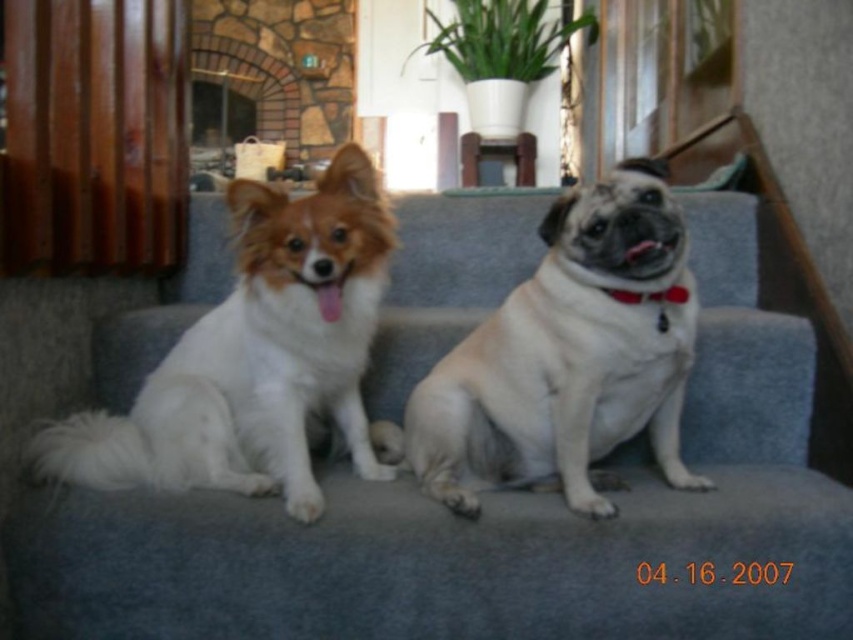
Is gray fabric couch at center further to the viewer compared to white fabric neckband at center?

That is False.

What do you see at coordinates (492, 525) in the screenshot?
I see `gray fabric couch at center` at bounding box center [492, 525].

Where is `gray fabric couch at center`? This screenshot has width=853, height=640. gray fabric couch at center is located at coordinates (492, 525).

Locate an element on the screen. The height and width of the screenshot is (640, 853). white fluffy dog at left is located at coordinates (256, 356).

Can you confirm if white fluffy dog at left is positioned below white fur dog at center?

Indeed, white fluffy dog at left is positioned under white fur dog at center.

Is point (223, 390) closer to viewer compared to point (445, 396)?

That is False.

Locate an element on the screen. white fluffy dog at left is located at coordinates point(256,356).

Can you confirm if white fluffy dog at left is thinner than white fabric neckband at center?

Incorrect, white fluffy dog at left's width is not less than white fabric neckband at center's.

Is point (358, 237) closer to viewer compared to point (614, 289)?

No, it is behind (614, 289).

Find the location of a particular element. The height and width of the screenshot is (640, 853). white fluffy dog at left is located at coordinates (256, 356).

Locate an element on the screen. The height and width of the screenshot is (640, 853). white fluffy dog at left is located at coordinates [x=256, y=356].